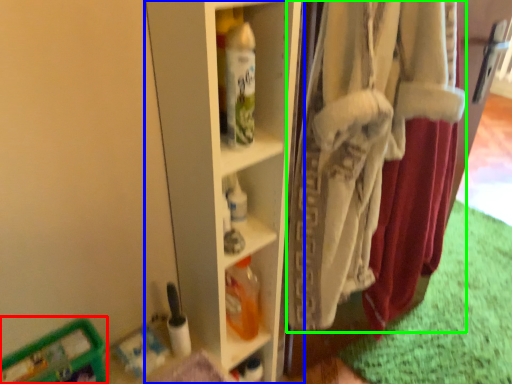
Question: Considering the real-world distances, which object is closest to wide (highlighted by a red box)? shelf (highlighted by a blue box) or underclothes (highlighted by a green box).

Choices:
 (A) shelf
 (B) underclothes

Answer: (A)